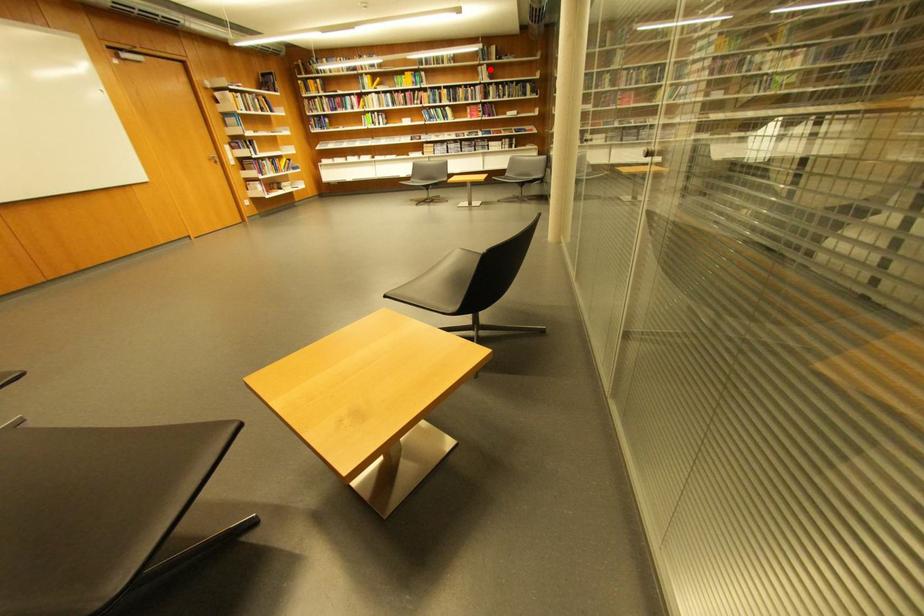
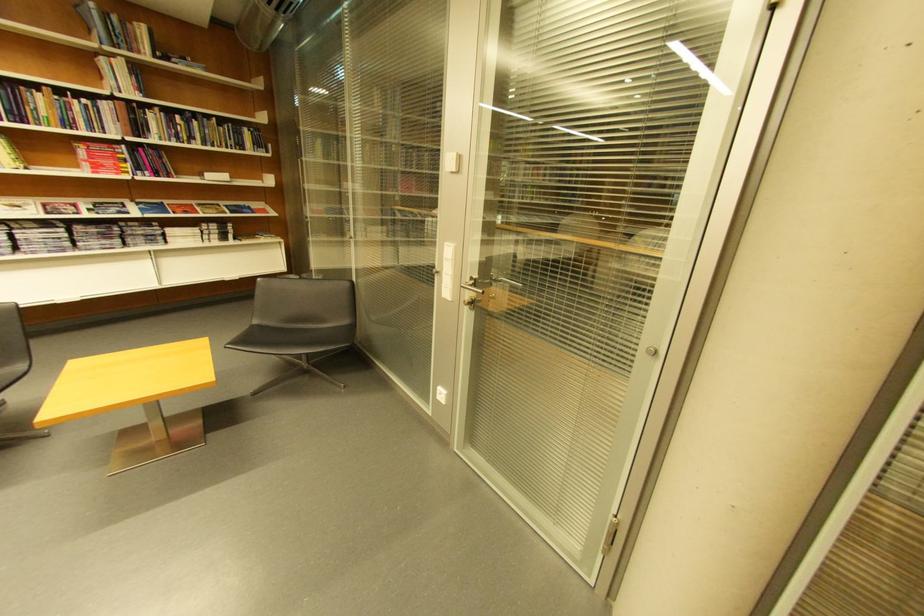
Locate, in the second image, the point that corresponds to the highlighted location in the first image.

(113, 62)